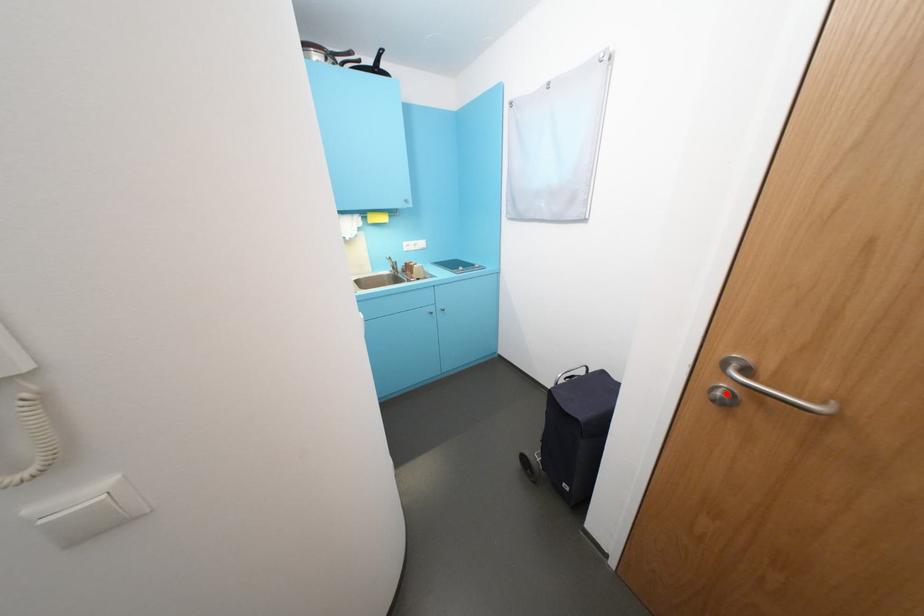
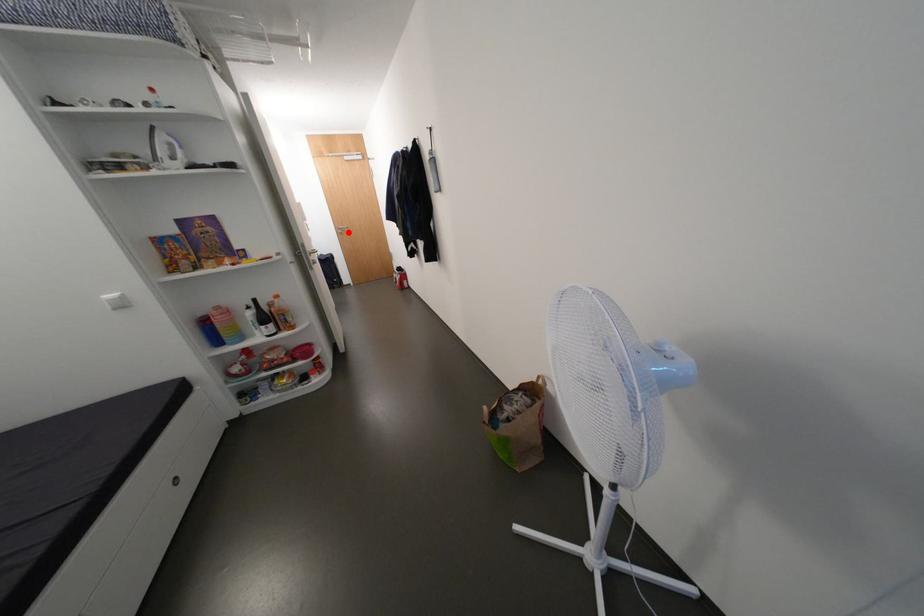
I am providing you with two images of the same scene from different viewpoints. A red point is marked on the first image and another point is marked on the second image. Is the red point in image1 aligned with the point shown in image2?

Yes